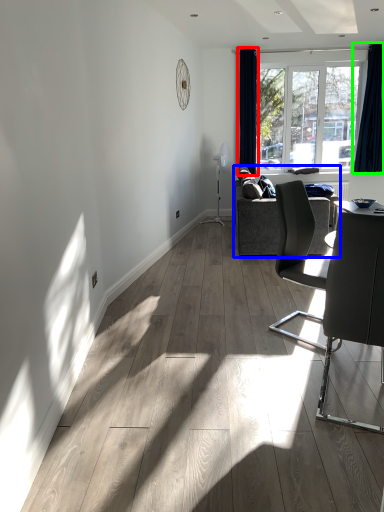
Question: Which is nearer to the curtain (highlighted by a red box)? studio couch (highlighted by a blue box) or curtain (highlighted by a green box).

Choices:
 (A) studio couch
 (B) curtain

Answer: (B)